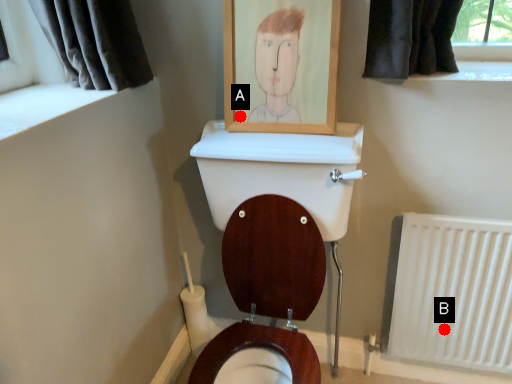
Question: Two points are circled on the image, labeled by A and B beside each circle. Which of the following is the closest to the observer?

Choices:
 (A) A is closer
 (B) B is closer

Answer: (A)